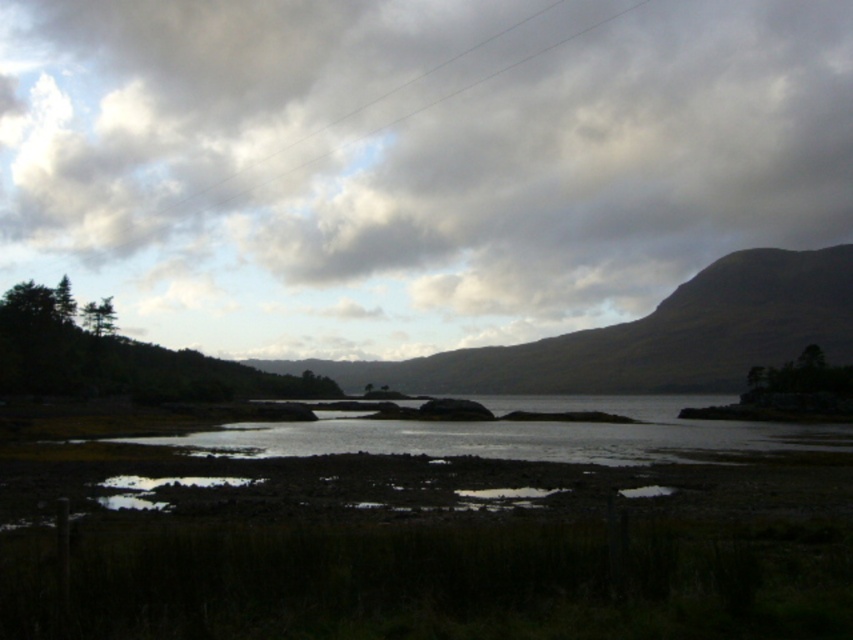
Does green grassy hill at upper center have a smaller size compared to shiny metallic puddle at lower center?

Actually, green grassy hill at upper center might be larger than shiny metallic puddle at lower center.

Where is `green grassy hill at upper center`? Image resolution: width=853 pixels, height=640 pixels. green grassy hill at upper center is located at coordinates (648, 337).

Locate an element on the screen. This screenshot has height=640, width=853. cloudy sky at upper center is located at coordinates (410, 161).

Does cloudy sky at upper center have a larger size compared to green grassy hill at upper center?

Correct, cloudy sky at upper center is larger in size than green grassy hill at upper center.

Is point (560, 332) farther from camera compared to point (498, 362)?

Yes.

Image resolution: width=853 pixels, height=640 pixels. In order to click on cloudy sky at upper center in this screenshot , I will do point(410,161).

From the picture: Which of these two, green grassy hill at upper center or clear water at center, stands shorter?

Standing shorter between the two is clear water at center.

I want to click on green grassy hill at upper center, so click(x=648, y=337).